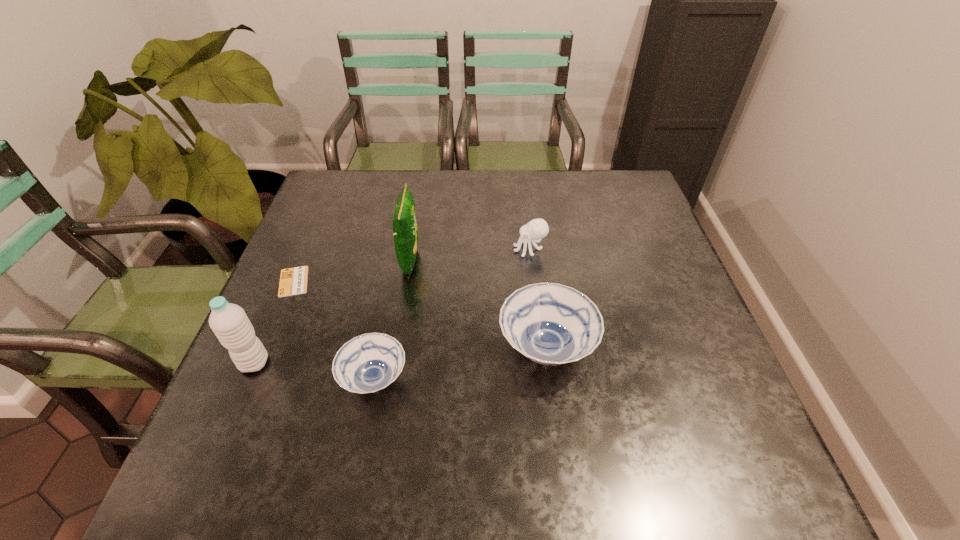
Locate an element on the screen. vacant region at the left edge of the desktop is located at coordinates (300, 328).

Find the location of `vacant space at the right edge of the desktop`. vacant space at the right edge of the desktop is located at coordinates [x=650, y=233].

Where is `vacant position at the far left corner of the desktop`? The width and height of the screenshot is (960, 540). vacant position at the far left corner of the desktop is located at coordinates (362, 176).

Identify the location of vacant area between the water bottle and the fifth tallest object. The height and width of the screenshot is (540, 960). (314, 371).

Find the location of `vacant area that lies between the fifth tallest object and the crisp (potato chip)`. vacant area that lies between the fifth tallest object and the crisp (potato chip) is located at coordinates (393, 320).

Image resolution: width=960 pixels, height=540 pixels. Find the location of `empty location between the water bottle and the left soup bowl`. empty location between the water bottle and the left soup bowl is located at coordinates (314, 371).

Where is `unoccupied position between the taller soup bowl and the second shortest object`? unoccupied position between the taller soup bowl and the second shortest object is located at coordinates (460, 363).

Identify the location of empty space between the shortest object and the water bottle. The height and width of the screenshot is (540, 960). (274, 322).

Identify the location of free spot between the taller soup bowl and the identity card. (420, 315).

Identify the location of vacant space in between the octopus and the crisp (potato chip). The image size is (960, 540). (470, 255).